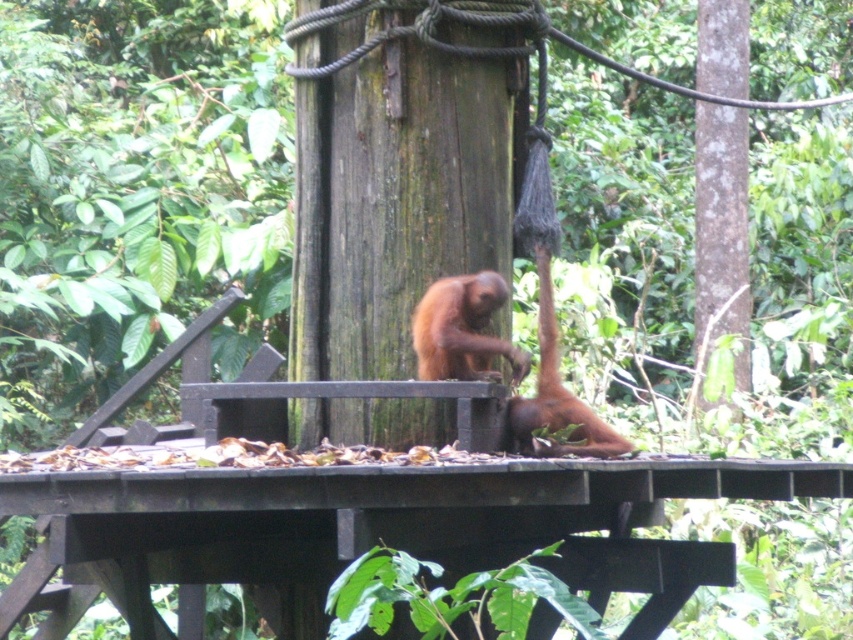
Is orange fur monkey at center smaller than brown fur monkey at center?

Correct, orange fur monkey at center occupies less space than brown fur monkey at center.

Who is more distant from viewer, (434, 356) or (532, 424)?

The point (434, 356) is more distant.

Find the location of `orange fur monkey at center`. orange fur monkey at center is located at coordinates (462, 330).

Identify the location of orange fur monkey at center. (462, 330).